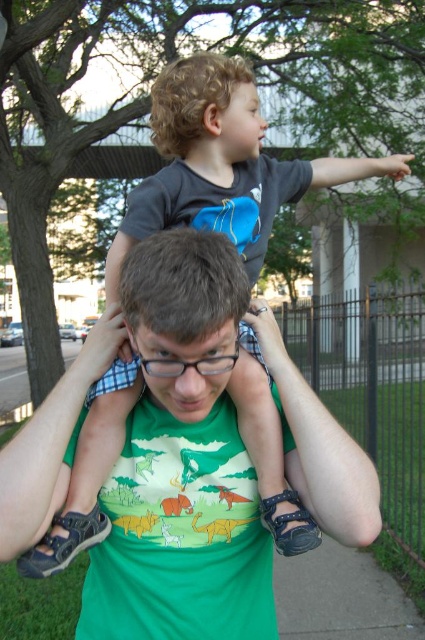
You are a photographer trying to capture a candid shot of the two people in the image. Since the green matte shirt at center and curly blonde hair at upper center are both in the frame, which one should you focus on if you want to ensure the subject with the smaller size is properly framed?

The green matte shirt at center has a smaller size compared to curly blonde hair at upper center, so you should focus on the green matte shirt at center to ensure the smaller subject is properly framed.

You are a photographer trying to capture a candid shot of the two people in the image. Since the green matte shirt at center and the curly blonde hair at upper center are in different positions, which one is closer to the camera?

The green matte shirt at center is below curly blonde hair at upper center, so the curly blonde hair at upper center is closer to the camera.